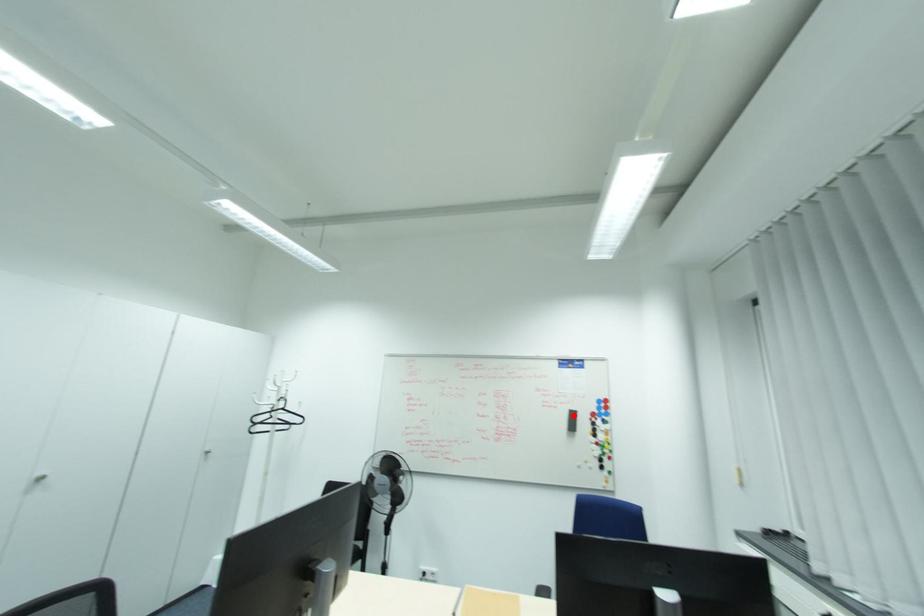
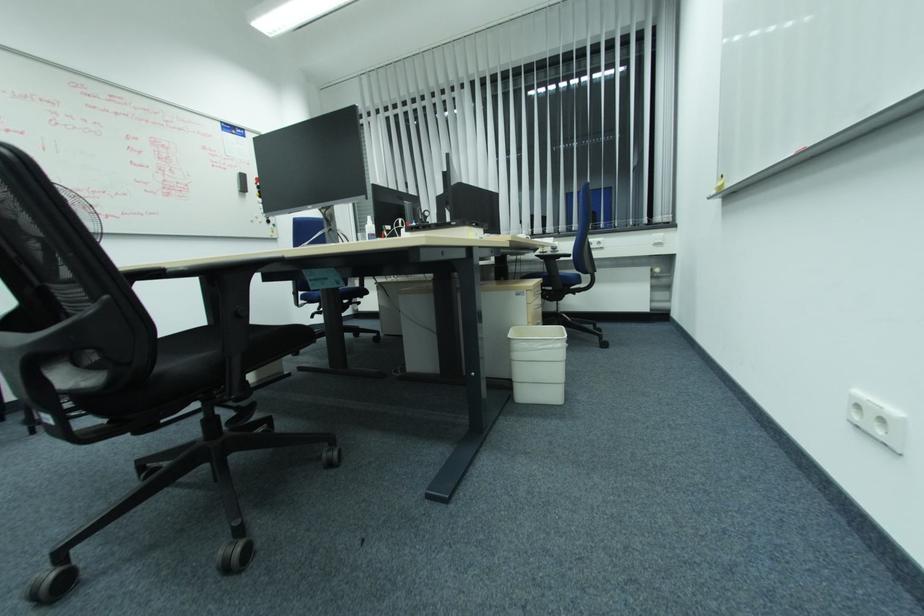
Where in the second image is the point corresponding to the highlighted location from the first image?

(244, 177)